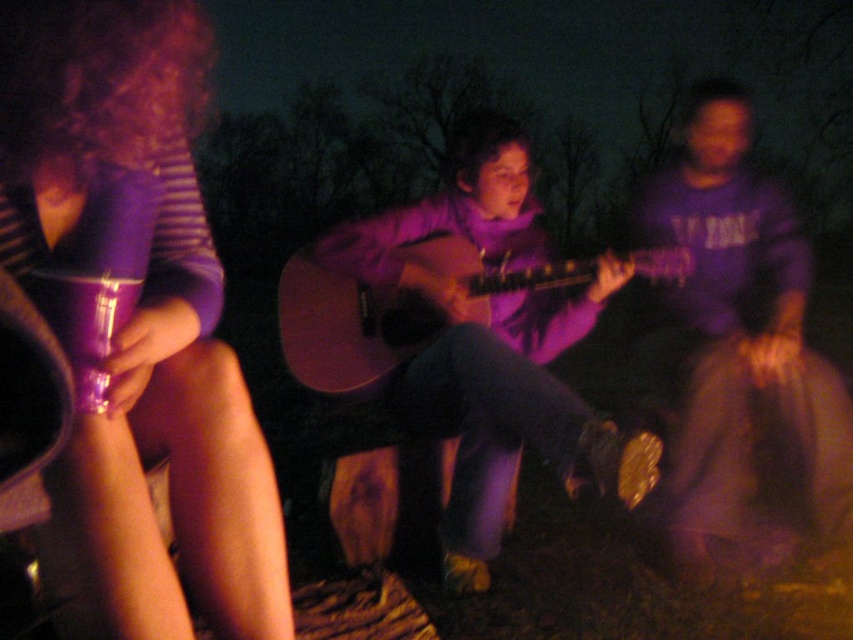
Question: Considering the real-world distances, which object is farthest from the purple matte guitar at center?

Choices:
 (A) matte acoustic guitar at center
 (B) matte purple cup at left

Answer: (B)

Question: Is purple matte guitar at center below matte acoustic guitar at center?

Choices:
 (A) no
 (B) yes

Answer: (B)

Question: Does purple matte guitar at center come in front of matte acoustic guitar at center?

Choices:
 (A) no
 (B) yes

Answer: (B)

Question: Can you confirm if matte purple cup at left is thinner than purple matte guitar at center?

Choices:
 (A) no
 (B) yes

Answer: (B)

Question: Which point appears farthest from the camera in this image?

Choices:
 (A) (163, 140)
 (B) (506, 188)
 (C) (469, 312)

Answer: (B)

Question: Which is nearer to the purple matte guitar at center?

Choices:
 (A) matte purple cup at left
 (B) matte acoustic guitar at center

Answer: (B)